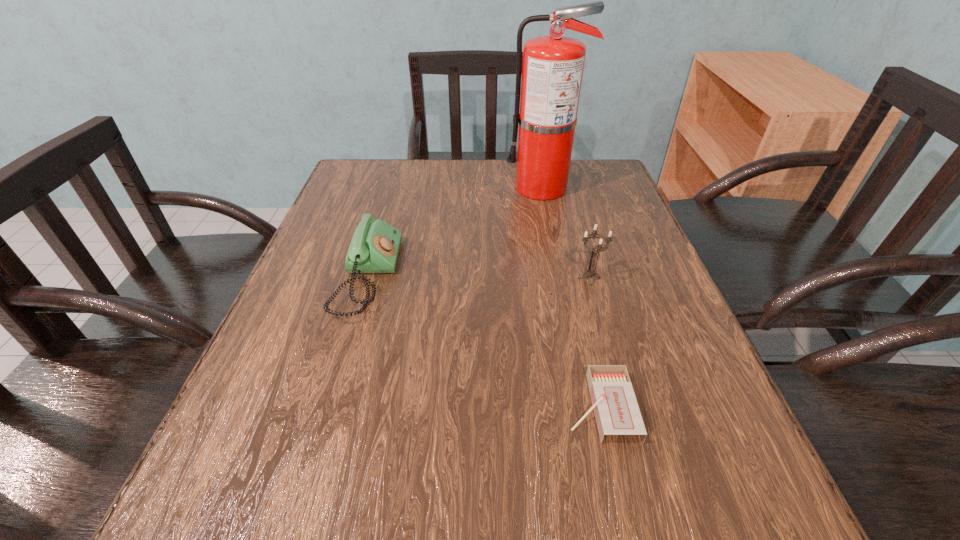
Locate an element on the screen. This screenshot has height=540, width=960. free space between the third shortest object and the fire extinguisher is located at coordinates (565, 233).

Locate an element on the screen. vacant point located between the telephone and the fire extinguisher is located at coordinates (455, 232).

Image resolution: width=960 pixels, height=540 pixels. Identify the location of free space that is in between the shortest object and the candle holder. (594, 343).

At what (x,y) coordinates should I click in order to perform the action: click on vacant space that is in between the second tallest object and the shortest object. Please return your answer as a coordinate pair (x, y). Looking at the image, I should click on (594, 343).

Locate an element on the screen. vacant area between the leftmost object and the farthest object is located at coordinates (455, 232).

The width and height of the screenshot is (960, 540). Identify the location of free space between the third tallest object and the second tallest object. (479, 278).

Choose which object is the nearest neighbor to the shortest object. Please provide its 2D coordinates. Your answer should be formatted as a tuple, i.e. [(x, y)], where the tuple contains the x and y coordinates of a point satisfying the conditions above.

[(590, 272)]

Where is `object that can be found as the third closest to the second shortest object`? The width and height of the screenshot is (960, 540). object that can be found as the third closest to the second shortest object is located at coordinates (590, 272).

The height and width of the screenshot is (540, 960). In order to click on free location that satisfies the following two spatial constraints: 1. on the dial of the telephone; 2. on the back side of the candle holder in this screenshot , I will do `click(368, 278)`.

Where is `vacant position in the image that satisfies the following two spatial constraints: 1. on the dial of the second tallest object; 2. on the left side of the telephone`? The image size is (960, 540). vacant position in the image that satisfies the following two spatial constraints: 1. on the dial of the second tallest object; 2. on the left side of the telephone is located at coordinates (368, 278).